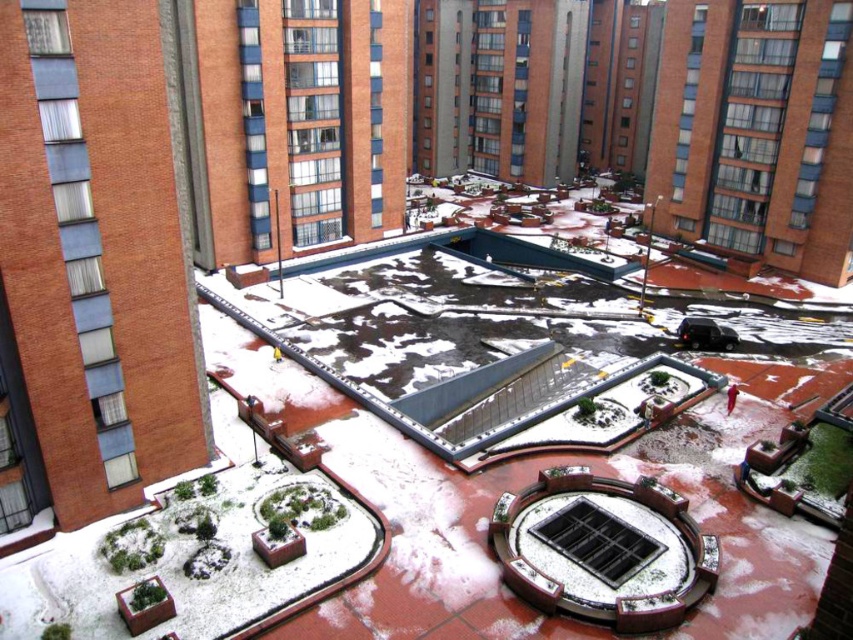
In the scene shown: Can you confirm if brick building at center is taller than brick building at upper right?

Indeed, brick building at center has a greater height compared to brick building at upper right.

Is brick building at center thinner than brick building at upper right?

Incorrect, brick building at center's width is not less than brick building at upper right's.

I want to click on brick building at center, so click(294, 122).